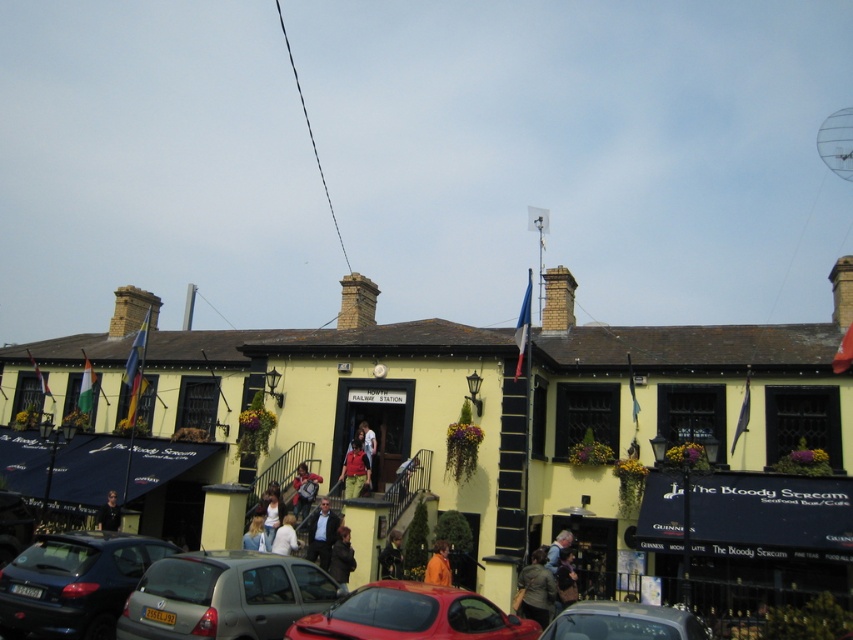
Consider the image. Which is more to the right, matte gray hatchback at lower center or light blue shirt at lower center?

matte gray hatchback at lower center

Is matte gray hatchback at lower center positioned at the back of light blue shirt at lower center?

No, it is not.

Which is in front, point (230, 560) or point (251, 522)?

Point (230, 560) is in front.

I want to click on matte gray hatchback at lower center, so click(x=223, y=596).

Does light brown leather jacket at lower left have a lesser height compared to matte red jacket at center?

Yes, light brown leather jacket at lower left is shorter than matte red jacket at center.

Which is behind, point (97, 528) or point (363, 435)?

Positioned behind is point (363, 435).

This screenshot has width=853, height=640. What do you see at coordinates (108, 513) in the screenshot?
I see `light brown leather jacket at lower left` at bounding box center [108, 513].

Image resolution: width=853 pixels, height=640 pixels. Identify the location of light brown leather jacket at lower left. (108, 513).

Does matte gray hatchback at lower center have a greater width compared to matte red shirt at center?

Indeed, matte gray hatchback at lower center has a greater width compared to matte red shirt at center.

Which is in front, point (154, 576) or point (350, 454)?

Positioned in front is point (154, 576).

Is point (286, 586) farther from camera compared to point (344, 488)?

No, it is not.

The image size is (853, 640). What are the coordinates of `matte gray hatchback at lower center` in the screenshot? It's located at (223, 596).